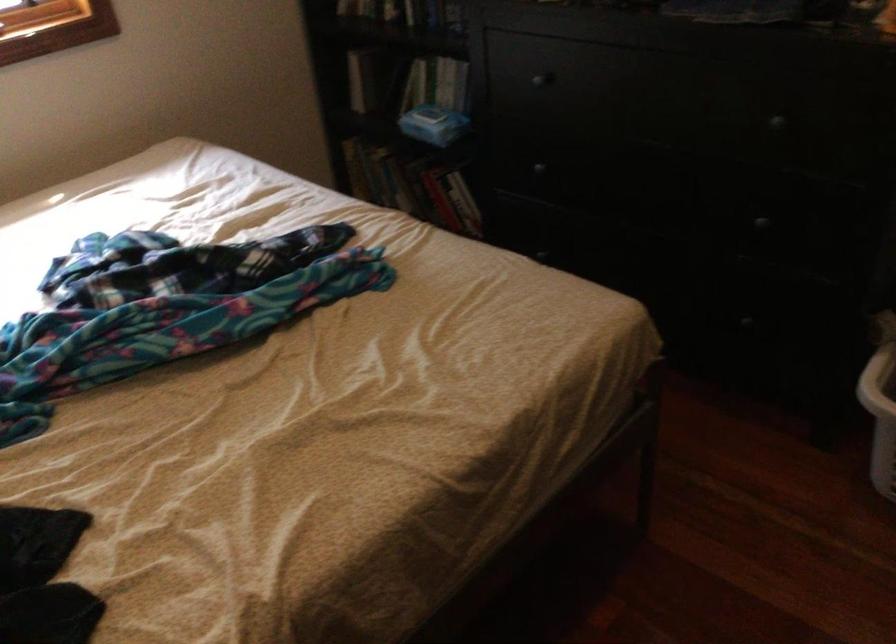
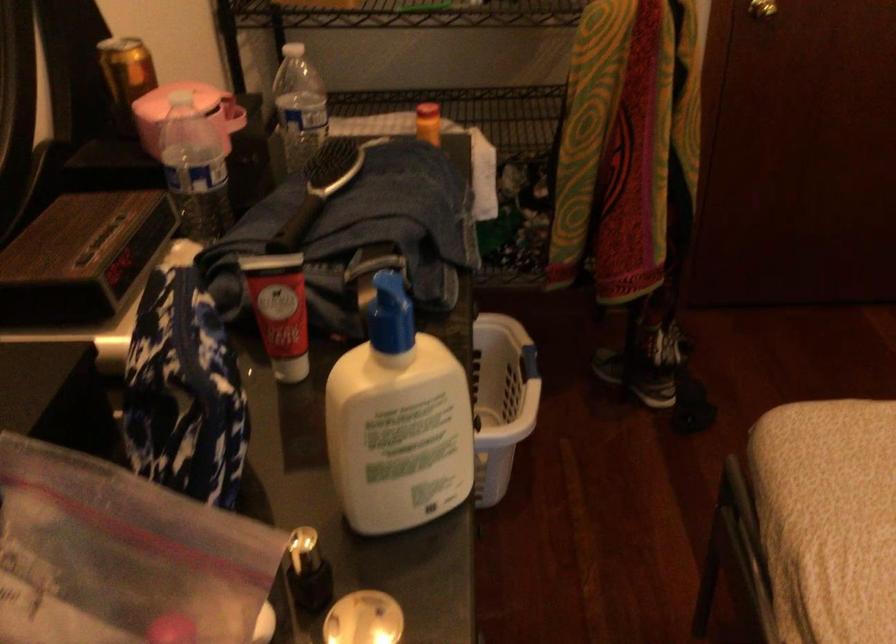
The point at (567, 290) is marked in the first image. Where is the corresponding point in the second image?

(828, 488)